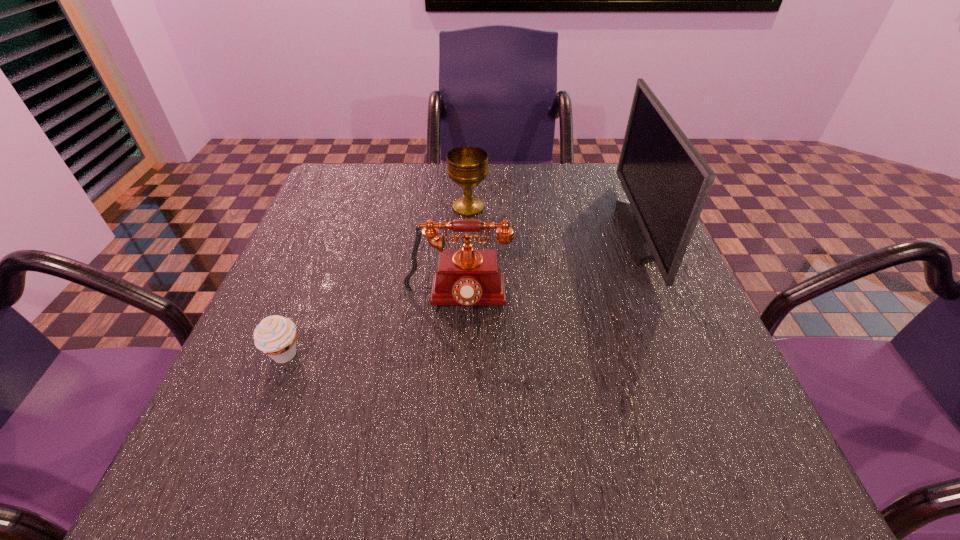
At what (x,y) coordinates should I click in order to perform the action: click on free space located on the back of the chalice. Please return your answer as a coordinate pair (x, y). This screenshot has width=960, height=540. Looking at the image, I should click on (469, 171).

The height and width of the screenshot is (540, 960). I want to click on vacant region located 0.170m on the back of the muffin, so click(x=316, y=275).

Where is `monitor present at the far edge`? This screenshot has height=540, width=960. monitor present at the far edge is located at coordinates (666, 180).

Where is `chalice located at the far edge`? chalice located at the far edge is located at coordinates (467, 166).

This screenshot has width=960, height=540. Identify the location of object at the left edge. (275, 335).

The image size is (960, 540). I want to click on object that is at the right edge, so click(666, 180).

The height and width of the screenshot is (540, 960). In order to click on object at the far right corner in this screenshot , I will do click(x=666, y=180).

In order to click on free space at the far edge of the desktop in this screenshot , I will do 415,166.

Locate an element on the screen. vacant space at the near edge of the desktop is located at coordinates (550, 485).

Locate an element on the screen. vacant space at the left edge is located at coordinates (267, 396).